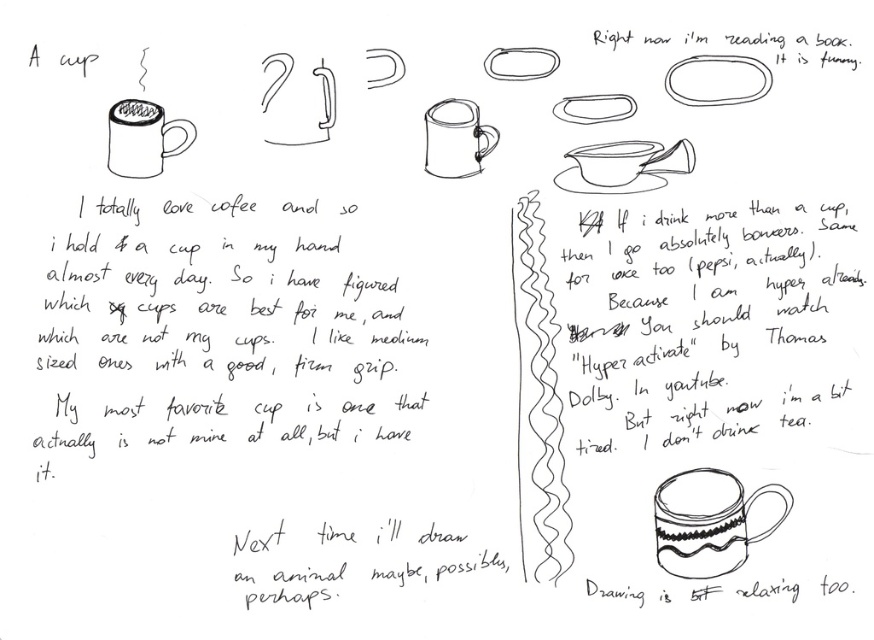
Based on the photo, you are an artist reviewing a sketch of a matte ceramic mug at center and a white matte saucer at upper center. Based on the drawing, which object is positioned higher on the page?

The matte ceramic mug at center is above the white matte saucer at upper center, so the matte ceramic mug at center is positioned higher on the page.

You are an artist trying to organize your sketchbook. You see the black paper at upper center and the speckled ceramic mug at lower right. Which object is taller in the drawing?

The black paper at upper center is taller than the speckled ceramic mug at lower right.

What is located at the coordinate point (x=720, y=330) on the paper?

The black paper at upper center is located at point (x=720, y=330).